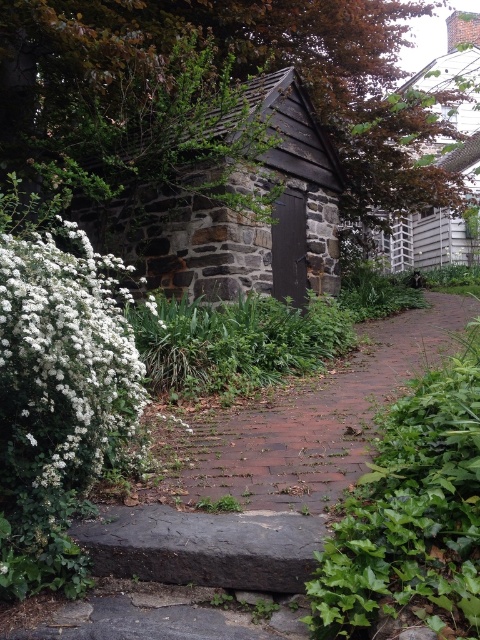
Question: Can you confirm if white fluffy bush at left is positioned above brick at center?

Choices:
 (A) no
 (B) yes

Answer: (B)

Question: Which object appears farthest from the camera in this image?

Choices:
 (A) dark brown stone log cabin at center
 (B) white fluffy bush at left
 (C) brick at center

Answer: (A)

Question: Does dark brown stone log cabin at center appear on the right side of white fluffy bush at left?

Choices:
 (A) yes
 (B) no

Answer: (A)

Question: Which point appears farthest from the camera in this image?

Choices:
 (A) pos(100,243)
 (B) pos(59,426)
 (C) pos(267,467)

Answer: (A)

Question: Is dark brown stone log cabin at center wider than brick at center?

Choices:
 (A) yes
 (B) no

Answer: (A)

Question: Among these points, which one is farthest from the camera?

Choices:
 (A) (144, 227)
 (B) (335, 452)

Answer: (A)